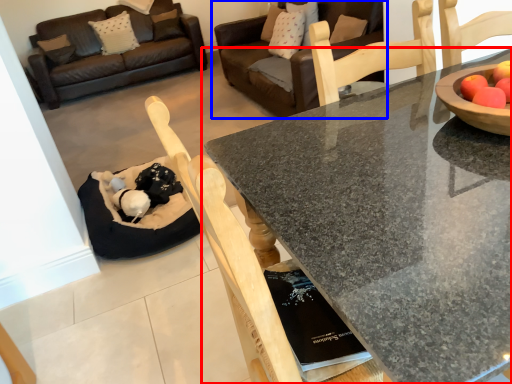
Question: Which point is closer to the camera, coffee table (highlighted by a red box) or studio couch (highlighted by a blue box)?

Choices:
 (A) coffee table
 (B) studio couch

Answer: (A)